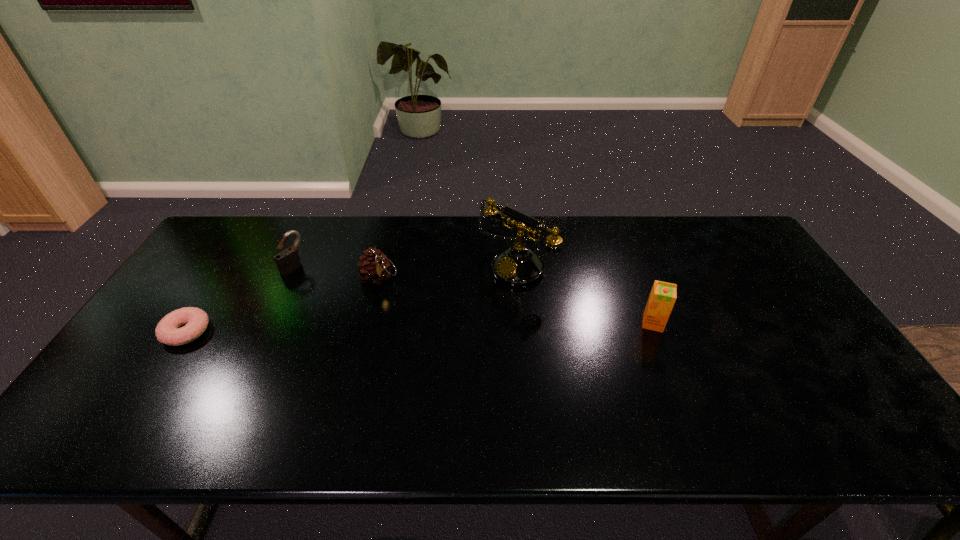
This screenshot has height=540, width=960. I want to click on object at the left edge, so click(x=168, y=332).

Identify the location of free region at the far edge of the desktop. (480, 252).

I want to click on vacant space at the near edge, so click(x=484, y=399).

Locate an element on the screen. The image size is (960, 540). vacant space at the right edge of the desktop is located at coordinates (804, 339).

Locate an element on the screen. vacant space at the far left corner is located at coordinates (251, 230).

Locate an element on the screen. This screenshot has height=540, width=960. free space at the far right corner of the desktop is located at coordinates (732, 235).

This screenshot has height=540, width=960. In the image, there is a desktop. Identify the location of free space at the near right corner. (825, 401).

You are a GUI agent. You are given a task and a screenshot of the screen. Output one action in this format:
    pyautogui.click(x=<x>, y=<y>)
    Task: Click on the blank region between the fourth object from left to right and the orange juice
    Image resolution: width=960 pixels, height=540 pixels.
    Given the screenshot: What is the action you would take?
    pyautogui.click(x=585, y=295)

Locate an element on the screen. The width and height of the screenshot is (960, 540). free spot between the doughnut and the pinecone is located at coordinates (283, 305).

At what (x,y) coordinates should I click in order to perform the action: click on free space between the tallest object and the pinecone. Please return your answer as a coordinate pair (x, y). Looking at the image, I should click on (447, 272).